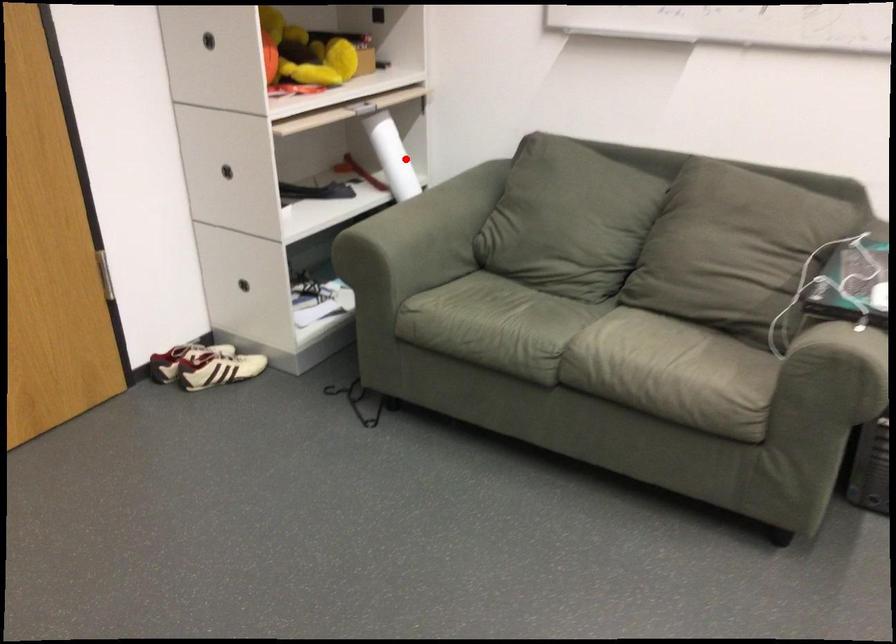
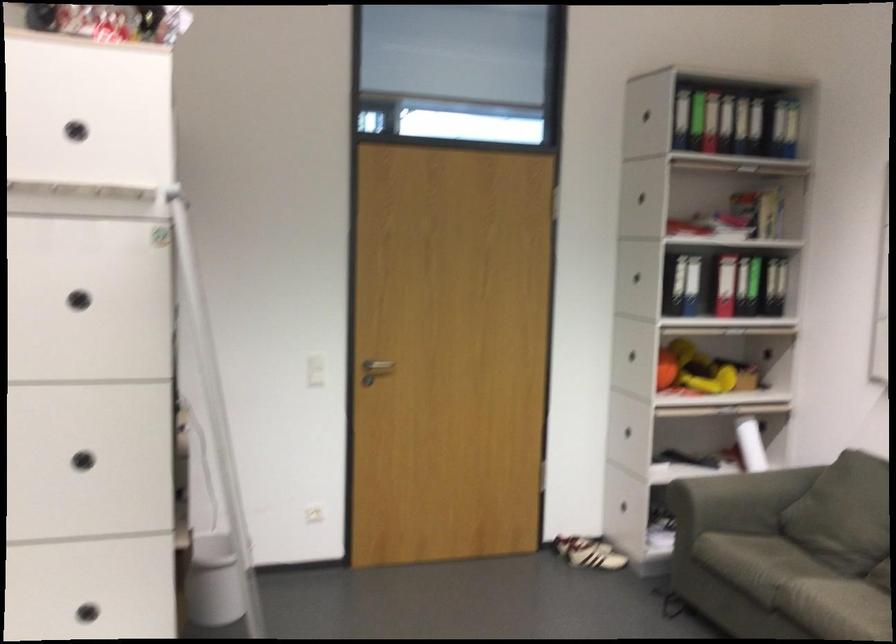
Question: A red point is marked in image1. In image2, is the corresponding 3D point closer to the camera or farther? Reply with the corresponding letter.

Choices:
 (A) The corresponding 3D point is closer.
 (B) The corresponding 3D point is farther.

Answer: (B)